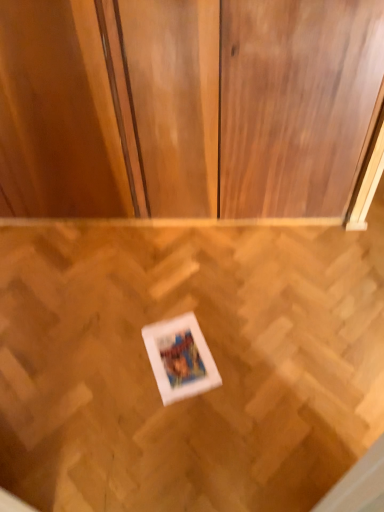
Question: From a real-world perspective, is matte wood dresser at center located beneath white matte picture frame at center?

Choices:
 (A) yes
 (B) no

Answer: (B)

Question: From a real-world perspective, is matte wood dresser at center physically above white matte picture frame at center?

Choices:
 (A) no
 (B) yes

Answer: (B)

Question: Does matte wood dresser at center have a greater height compared to white matte picture frame at center?

Choices:
 (A) no
 (B) yes

Answer: (B)

Question: Is matte wood dresser at center at the left side of white matte picture frame at center?

Choices:
 (A) no
 (B) yes

Answer: (B)

Question: Does matte wood dresser at center have a greater width compared to white matte picture frame at center?

Choices:
 (A) yes
 (B) no

Answer: (B)

Question: Does matte wood dresser at center touch white matte picture frame at center?

Choices:
 (A) no
 (B) yes

Answer: (A)

Question: Is matte wood dresser at center smaller than wooden parquet floor at center?

Choices:
 (A) yes
 (B) no

Answer: (B)

Question: Would you say matte wood dresser at center contains wooden parquet floor at center?

Choices:
 (A) yes
 (B) no

Answer: (B)

Question: Can you confirm if matte wood dresser at center is bigger than wooden parquet floor at center?

Choices:
 (A) no
 (B) yes

Answer: (B)

Question: Is matte wood dresser at center located outside wooden parquet floor at center?

Choices:
 (A) no
 (B) yes

Answer: (B)

Question: Could you tell me if matte wood dresser at center is facing wooden parquet floor at center?

Choices:
 (A) yes
 (B) no

Answer: (A)

Question: Can you confirm if matte wood dresser at center is thinner than wooden parquet floor at center?

Choices:
 (A) yes
 (B) no

Answer: (A)

Question: Considering the relative sizes of wooden parquet floor at center and matte wood dresser at center in the image provided, is wooden parquet floor at center shorter than matte wood dresser at center?

Choices:
 (A) no
 (B) yes

Answer: (B)